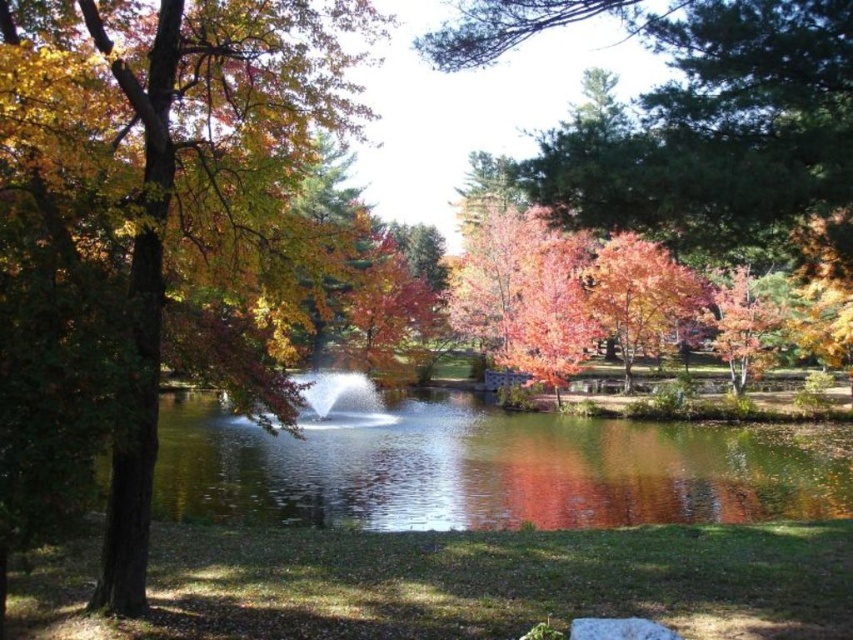
Does matte brown tree trunk at left have a lesser height compared to clear water at center?

Incorrect, matte brown tree trunk at left's height does not fall short of clear water at center's.

Locate an element on the screen. The width and height of the screenshot is (853, 640). matte brown tree trunk at left is located at coordinates (144, 230).

Find the location of a particular element. The height and width of the screenshot is (640, 853). matte brown tree trunk at left is located at coordinates (144, 230).

You are a GUI agent. You are given a task and a screenshot of the screen. Output one action in this format:
    pyautogui.click(x=<x>, y=<y>)
    Task: Click on the matte brown tree trunk at left
    This screenshot has height=640, width=853.
    Given the screenshot: What is the action you would take?
    pyautogui.click(x=144, y=230)

Is point (723, 465) farther from camera compared to point (343, 426)?

No, it is not.

Can you confirm if clear water at center is thinner than white frothy water at center?

Incorrect, clear water at center's width is not less than white frothy water at center's.

Is point (647, 456) farther from viewer compared to point (358, 388)?

No, it is not.

Where is `clear water at center`? This screenshot has width=853, height=640. clear water at center is located at coordinates coord(482,467).

From the picture: Can you confirm if matte brown tree trunk at left is bigger than white frothy water at center?

Indeed, matte brown tree trunk at left has a larger size compared to white frothy water at center.

Is matte brown tree trunk at left to the right of white frothy water at center from the viewer's perspective?

No, matte brown tree trunk at left is not to the right of white frothy water at center.

Which is behind, point (213, 332) or point (347, 416)?

Point (347, 416)

Where is `matte brown tree trunk at left`? The width and height of the screenshot is (853, 640). matte brown tree trunk at left is located at coordinates (144, 230).